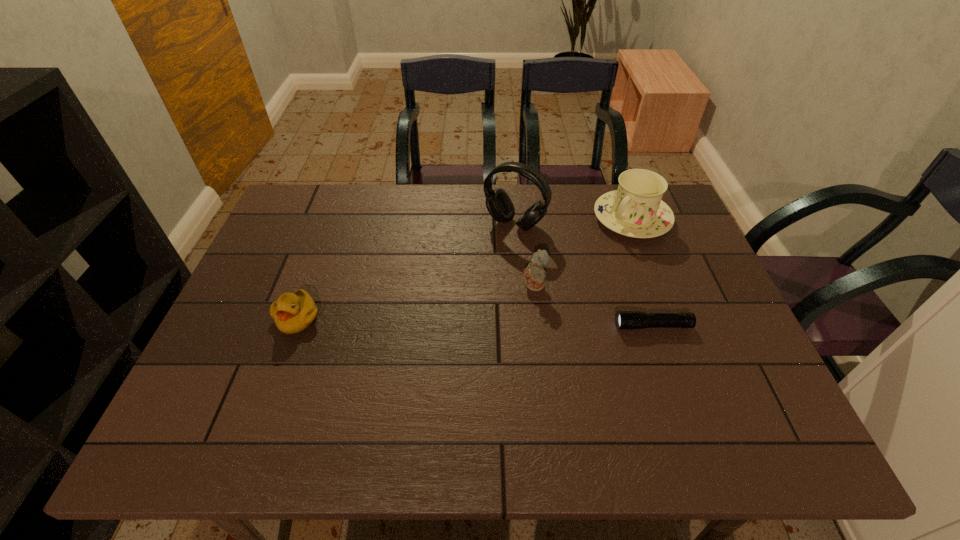
This screenshot has width=960, height=540. What are the coordinates of `the second shortest object` in the screenshot? It's located at (293, 312).

The width and height of the screenshot is (960, 540). Find the location of `duckling`. duckling is located at coordinates (293, 312).

Image resolution: width=960 pixels, height=540 pixels. Find the location of `flashlight`. flashlight is located at coordinates (625, 320).

Locate an element on the screen. the third farthest object is located at coordinates [x=535, y=275].

Where is `chinaware`? The height and width of the screenshot is (540, 960). chinaware is located at coordinates (636, 210).

At what (x,y) coordinates should I click in order to perform the action: click on the tallest object. Please return your answer as a coordinate pair (x, y). The width and height of the screenshot is (960, 540). Looking at the image, I should click on (499, 205).

Locate an element on the screen. This screenshot has width=960, height=540. vacant region located on the front-facing side of the duckling is located at coordinates (268, 401).

Find the location of a particular element. The height and width of the screenshot is (540, 960). vacant area located at the lens end of the shortest object is located at coordinates (470, 326).

The image size is (960, 540). What are the coordinates of `blank space located 0.240m at the lens end of the shortest object` in the screenshot? It's located at (518, 326).

Identify the location of blank area located 0.340m at the lens end of the shortest object. This screenshot has width=960, height=540. (478, 326).